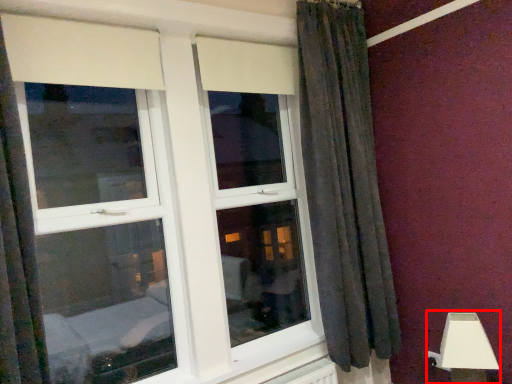
Question: Where is table lamp (annotated by the red box) located in relation to window in the image?

Choices:
 (A) left
 (B) right

Answer: (B)